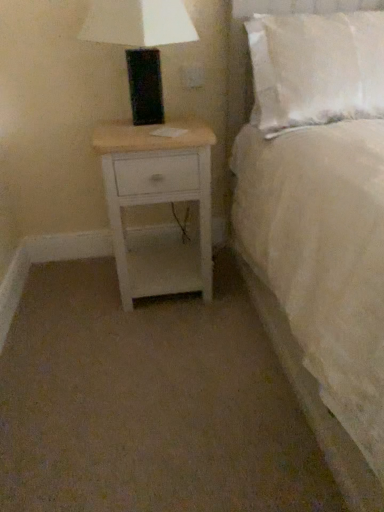
The image size is (384, 512). What are the coordinates of `free space to the left of white wood nightstand at lower left` in the screenshot? It's located at (79, 296).